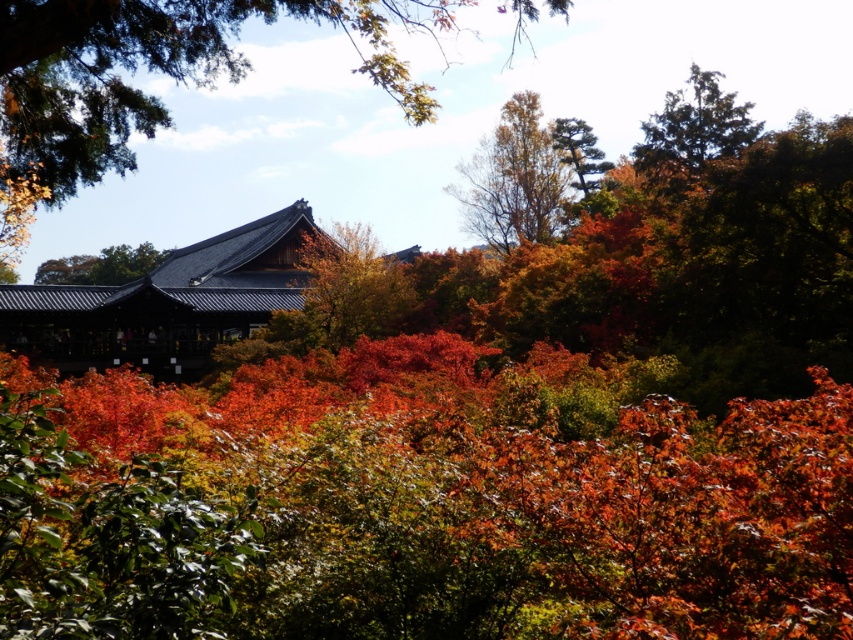
Between smooth brown tree trunk at center and shiny dark brown roof at upper center, which one is positioned higher?

shiny dark brown roof at upper center is higher up.

Does smooth brown tree trunk at center have a lesser width compared to shiny dark brown roof at upper center?

Yes, smooth brown tree trunk at center is thinner than shiny dark brown roof at upper center.

Between point (332, 236) and point (136, 273), which one is positioned in front?

Positioned in front is point (332, 236).

Where is `smooth brown tree trunk at center`? smooth brown tree trunk at center is located at coordinates (345, 291).

In the scene shown: Which is more to the left, shiny dark brown roof at upper center or green textured pine tree at upper center?

shiny dark brown roof at upper center

Does point (164, 256) come closer to viewer compared to point (579, 125)?

No, (164, 256) is behind (579, 125).

You are a GUI agent. You are given a task and a screenshot of the screen. Output one action in this format:
    pyautogui.click(x=<x>, y=<y>)
    Task: Click on the shiny dark brown roof at upper center
    
    Given the screenshot: What is the action you would take?
    pyautogui.click(x=102, y=266)

Between point (556, 188) and point (674, 104), which one is positioned in front?

Positioned in front is point (674, 104).

Who is higher up, brown textured tree at upper center or green textured tree at upper right?

green textured tree at upper right is above.

Locate an element on the screen. The height and width of the screenshot is (640, 853). brown textured tree at upper center is located at coordinates (514, 179).